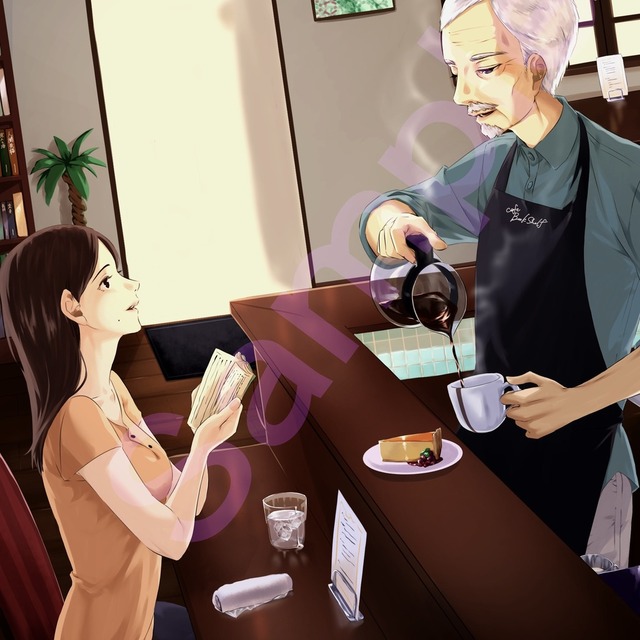
Locate an element on the screen. This screenshot has width=640, height=640. glass is located at coordinates (282, 500).